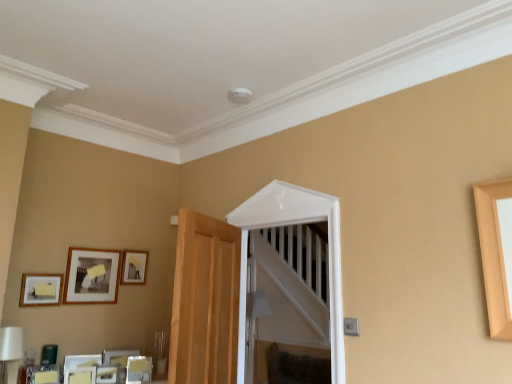
Question: Is wooden picture frame at upper left, marked as the 4th picture frame in a bottom-to-top arrangement, spatially inside matte black picture frame at lower left, the second picture frame when ordered from bottom to top, or outside of it?

Choices:
 (A) outside
 (B) inside

Answer: (A)

Question: From the image's perspective, relative to matte black picture frame at lower left, the 3th picture frame viewed from the top, is wooden picture frame at upper left, marked as the 4th picture frame in a bottom-to-top arrangement, above or below?

Choices:
 (A) below
 (B) above

Answer: (B)

Question: Which object is the closest to the wooden picture frame at upper left, which is counted as the 1th picture frame, starting from the top?

Choices:
 (A) matte black picture frame at upper left, the 3th picture frame ordered from the bottom
 (B) white glossy door at center
 (C) matte black picture frame at lower left, the 3th picture frame viewed from the top
 (D) matte wooden picture frame at lower left, which is the 1th picture frame from bottom to top
 (E) light brown wood door at center

Answer: (A)

Question: Considering the real-world distances, which object is farthest from the matte black picture frame at upper left, the 3th picture frame ordered from the bottom?

Choices:
 (A) matte black picture frame at lower left, the 3th picture frame viewed from the top
 (B) wooden picture frame at upper left, marked as the 4th picture frame in a bottom-to-top arrangement
 (C) white glossy door at center
 (D) light brown wood door at center
 (E) matte wooden picture frame at lower left, arranged as the fourth picture frame when viewed from the top

Answer: (C)